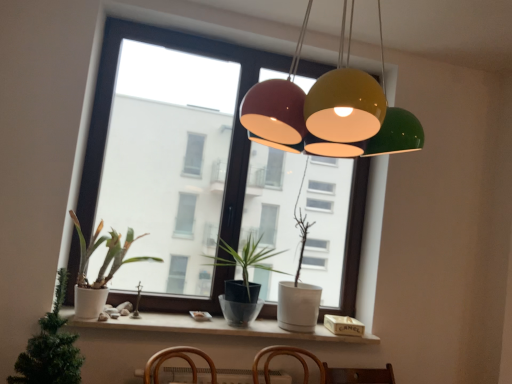
Question: Is transparent glass window at center taller than white matte pot at left, the 2th houseplant positioned from the front?

Choices:
 (A) yes
 (B) no

Answer: (A)

Question: Is transparent glass window at center positioned behind white matte pot at left, acting as the 2th houseplant starting from the back?

Choices:
 (A) yes
 (B) no

Answer: (A)

Question: Can you confirm if transparent glass window at center is smaller than white matte pot at left, acting as the 2th houseplant starting from the back?

Choices:
 (A) yes
 (B) no

Answer: (B)

Question: Considering the relative sizes of transparent glass window at center and white matte pot at left, the 2th houseplant positioned from the front, in the image provided, is transparent glass window at center shorter than white matte pot at left, the 2th houseplant positioned from the front,?

Choices:
 (A) no
 (B) yes

Answer: (A)

Question: Is transparent glass window at center positioned in front of white matte pot at left, the 2th houseplant positioned from the front?

Choices:
 (A) no
 (B) yes

Answer: (A)

Question: In terms of height, does white matte pot at left, the 2th houseplant positioned from the front, look taller or shorter compared to white matte window sill at lower center?

Choices:
 (A) short
 (B) tall

Answer: (B)

Question: Would you say white matte pot at left, acting as the 2th houseplant starting from the back, is to the left or to the right of white matte window sill at lower center in the picture?

Choices:
 (A) left
 (B) right

Answer: (A)

Question: Is white matte pot at left, acting as the 2th houseplant starting from the back, wider or thinner than white matte window sill at lower center?

Choices:
 (A) thin
 (B) wide

Answer: (B)

Question: From a real-world perspective, is white matte pot at left, acting as the 2th houseplant starting from the back, physically located above or below white matte window sill at lower center?

Choices:
 (A) below
 (B) above

Answer: (B)

Question: Considering their positions, is matte black pot at center, the third houseplant from the front, located in front of or behind white matte window sill at lower center?

Choices:
 (A) front
 (B) behind

Answer: (B)

Question: Considering the positions of matte black pot at center, the third houseplant from the front, and white matte window sill at lower center in the image, is matte black pot at center, the third houseplant from the front, taller or shorter than white matte window sill at lower center?

Choices:
 (A) tall
 (B) short

Answer: (A)

Question: Would you say matte black pot at center, arranged as the 1th houseplant when viewed from the back, is to the left or to the right of white matte window sill at lower center in the picture?

Choices:
 (A) left
 (B) right

Answer: (B)

Question: From the image's perspective, is matte black pot at center, the third houseplant from the front, located above or below white matte window sill at lower center?

Choices:
 (A) below
 (B) above

Answer: (B)

Question: From the image's perspective, is white matte window sill at lower center positioned above or below white matte pot at left, the 2th houseplant positioned from the front?

Choices:
 (A) below
 (B) above

Answer: (A)

Question: Relative to white matte pot at left, the 2th houseplant positioned from the front, is white matte window sill at lower center in front or behind?

Choices:
 (A) front
 (B) behind

Answer: (B)